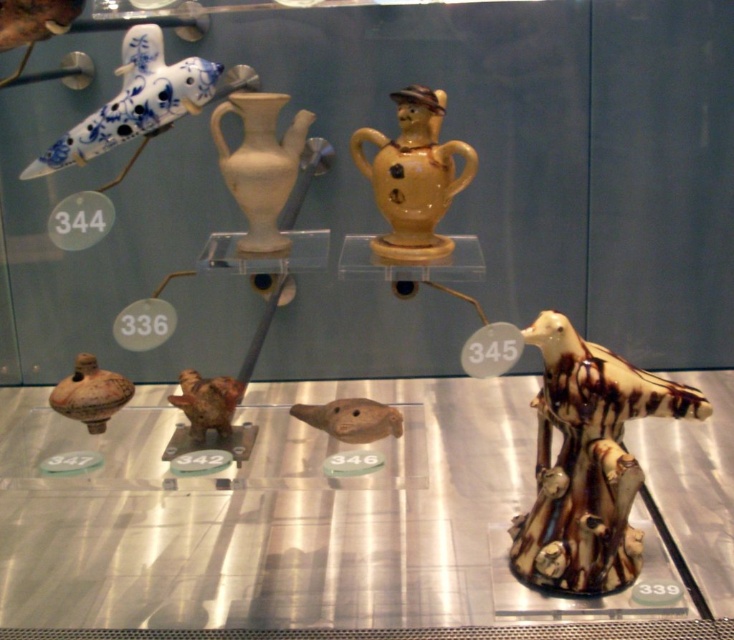
Is brown glaze ceramic bird at lower right closer to camera compared to blue and white glazed bird at upper left?

Yes, brown glaze ceramic bird at lower right is in front of blue and white glazed bird at upper left.

Does brown glaze ceramic bird at lower right have a lesser height compared to blue and white glazed bird at upper left?

In fact, brown glaze ceramic bird at lower right may be taller than blue and white glazed bird at upper left.

Where is `brown glaze ceramic bird at lower right`? brown glaze ceramic bird at lower right is located at coordinates (586, 461).

Between translucent glass table at lower center and white matte vase at upper center, which one has less height?

Standing shorter between the two is translucent glass table at lower center.

Does translucent glass table at lower center have a greater width compared to white matte vase at upper center?

Yes.

Who is more forward, (730, 444) or (297, 131)?

Positioned in front is point (297, 131).

Locate an element on the screen. translucent glass table at lower center is located at coordinates (265, 516).

Is yellow matte vase at center further to the viewer compared to brown matte bird at center?

No, yellow matte vase at center is closer to the viewer.

Is point (421, 250) positioned before point (195, 422)?

No, it is behind (195, 422).

Which is in front, point (390, 218) or point (208, 428)?

Positioned in front is point (208, 428).

Locate an element on the screen. yellow matte vase at center is located at coordinates (413, 176).